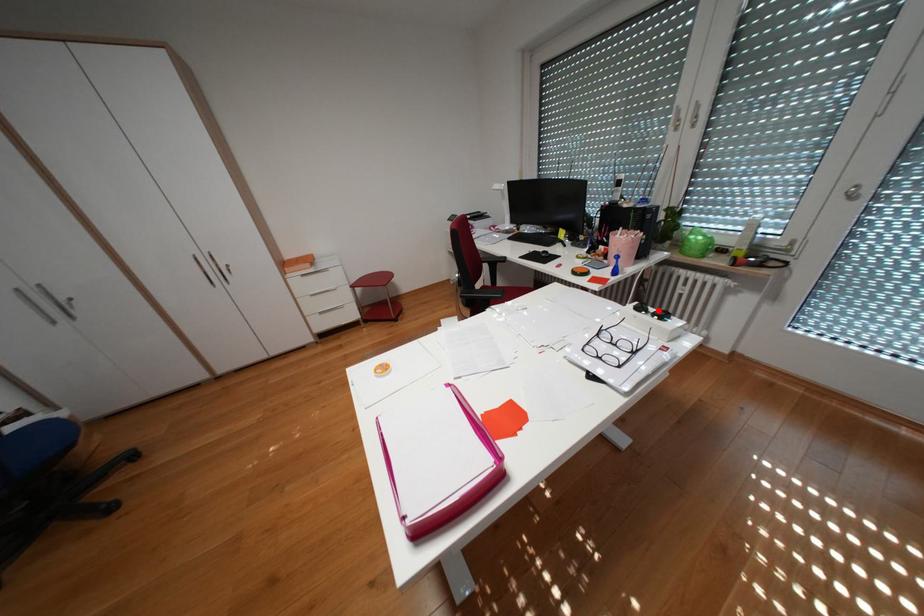
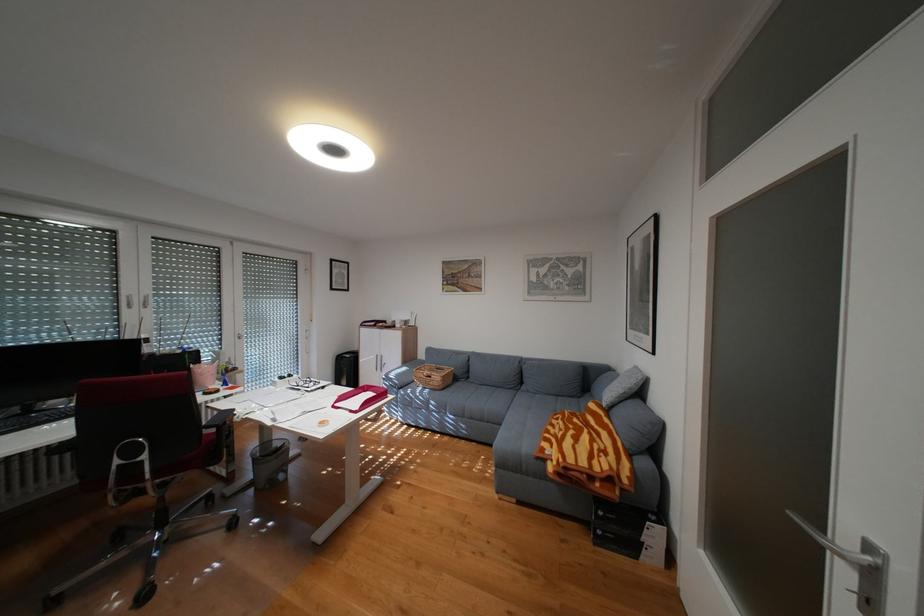
Where in the second image is the point corresponding to the highlighted location from the first image?

(297, 377)